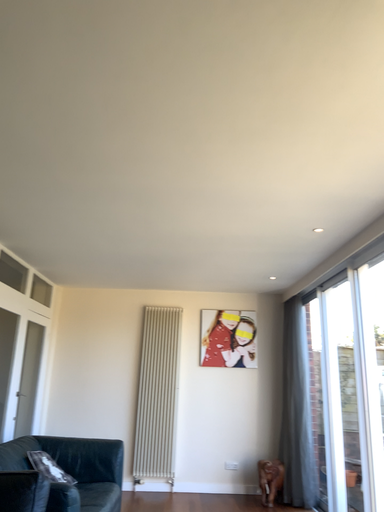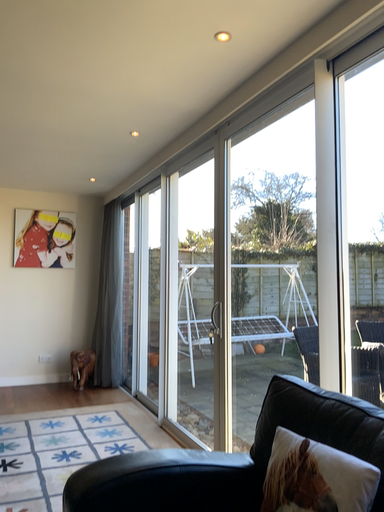
Question: Which way did the camera rotate in the video?

Choices:
 (A) rotated downward
 (B) rotated upward

Answer: (A)